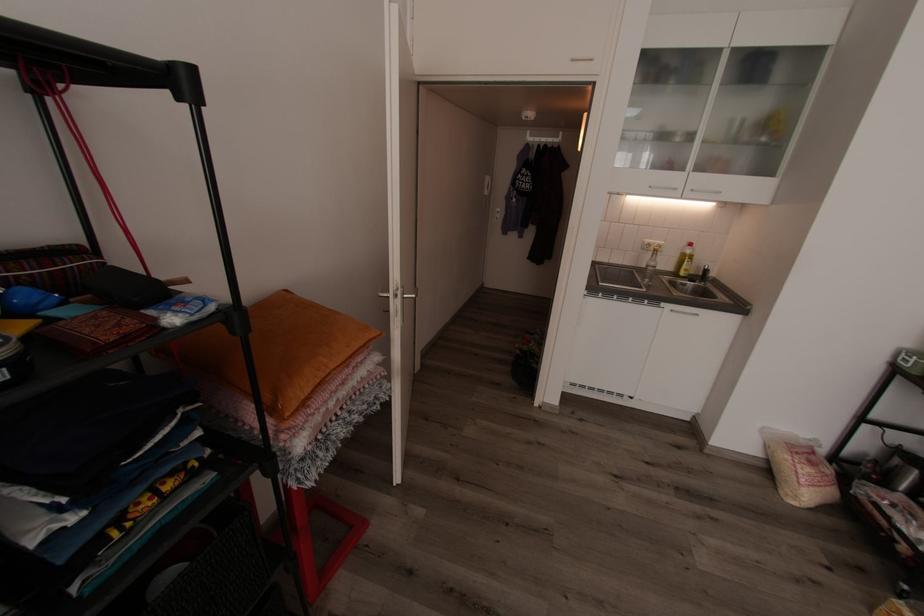
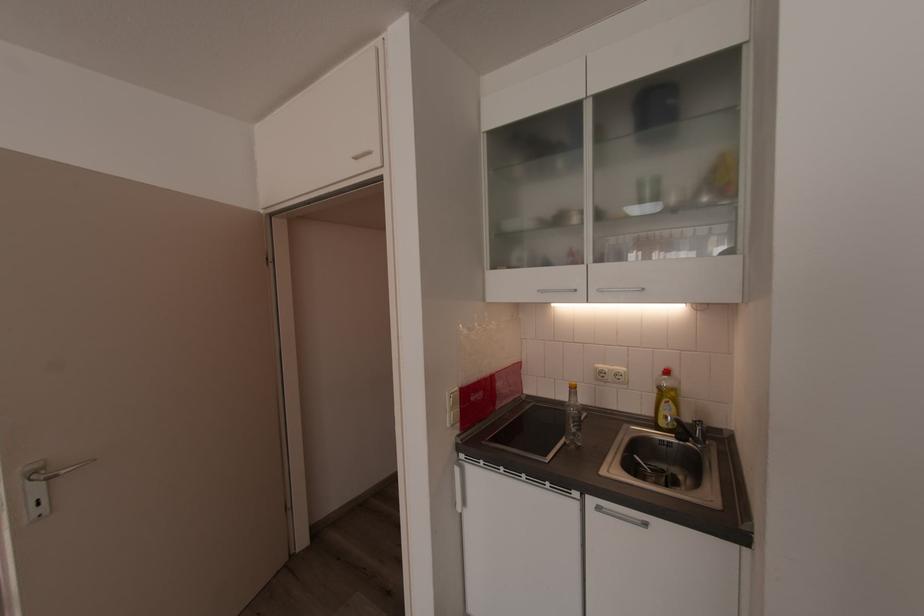
Based on the photo, what movement of the cameraman would produce the second image?

The cameraman moved toward right, forward.